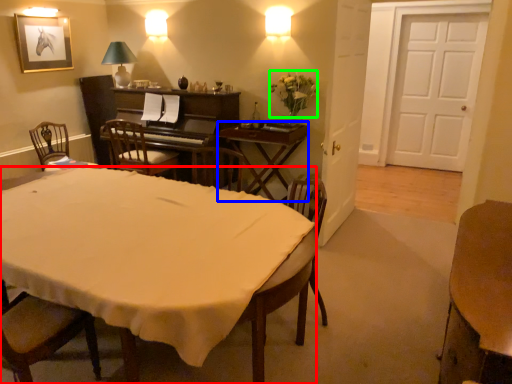
Question: Which object is the closest to the desk (highlighted by a red box)? Choose among these: table (highlighted by a blue box) or flower (highlighted by a green box).

Choices:
 (A) table
 (B) flower

Answer: (A)